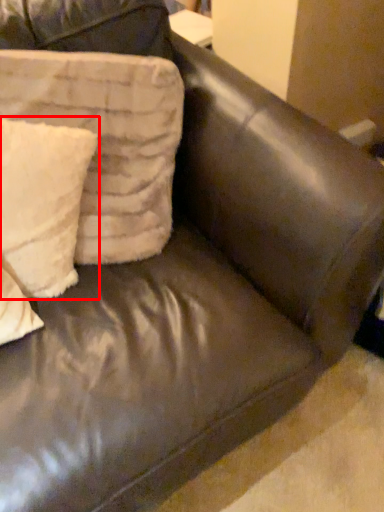
Question: Considering the relative positions of pillow (annotated by the red box) and pillow in the image provided, where is pillow (annotated by the red box) located with respect to the staircase?

Choices:
 (A) left
 (B) right

Answer: (A)